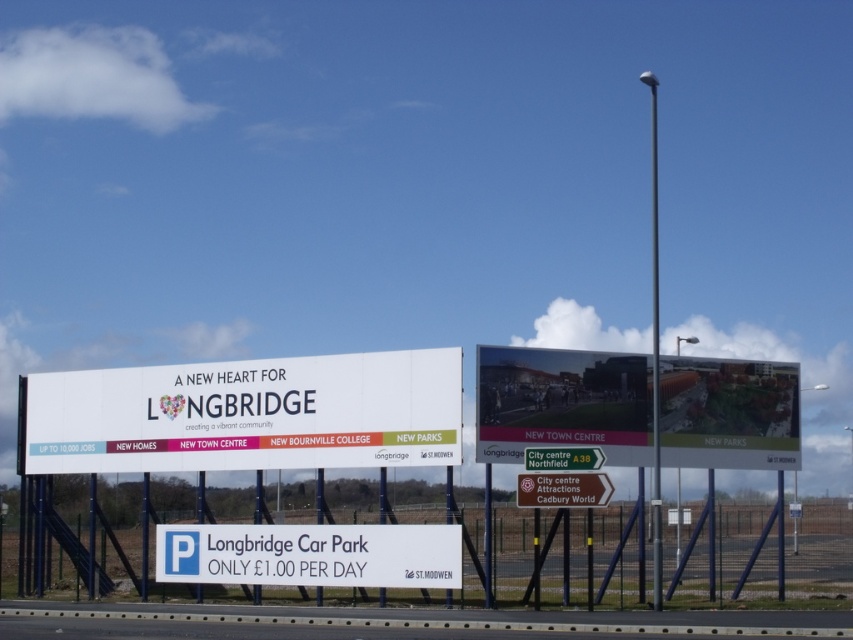
You are a pedestrian walking on the sidewalk and see the white matte signboard at center and the white plastic sign at lower center. Which one is placed higher up?

The white matte signboard at center is positioned over the white plastic sign at lower center, so it is placed higher up.

You are a city planner reviewing the layout of the two billboards in the image. The white matte signboard at center and the matte plastic billboard at center are both important for public information. Since space is limited, you need to decide which one to keep. Based on their sizes, which should be retained?

The white matte signboard at center has a larger size compared to the matte plastic billboard at center, so it should be retained as it can display more information effectively.

You are standing at the entrance of the park and want to read the text on the white matte signboard at center. Given that the average person can read a billboard from 30 meters away, will you be able to read it clearly from your current position?

The white matte signboard at center is 32.80 meters away from the viewer. Since the average reading distance is 30 meters, you are slightly beyond the comfortable range, so it might be difficult to read the text clearly without moving closer.